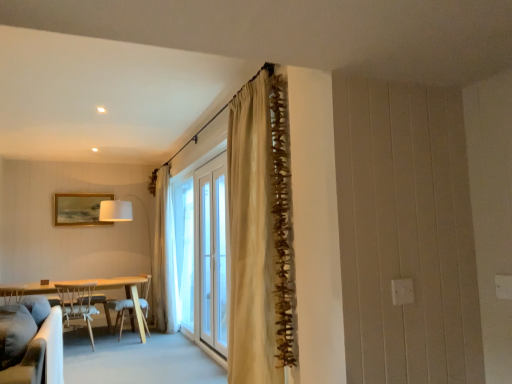
Question: Is white wood chair at left, which is the 2th chair in back-to-front order, bigger than white glass screen door at center?

Choices:
 (A) yes
 (B) no

Answer: (A)

Question: From the image's perspective, is white wood chair at left, which is the 2th chair in back-to-front order, on white glass screen door at center?

Choices:
 (A) yes
 (B) no

Answer: (B)

Question: Considering the relative positions of white wood chair at left, the first chair in the front-to-back sequence, and white glass screen door at center in the image provided, is white wood chair at left, the first chair in the front-to-back sequence, behind white glass screen door at center?

Choices:
 (A) no
 (B) yes

Answer: (B)

Question: Is white wood chair at left, which is the 2th chair in back-to-front order, to the left of white glass screen door at center from the viewer's perspective?

Choices:
 (A) yes
 (B) no

Answer: (A)

Question: Could you tell me if white wood chair at left, the first chair in the front-to-back sequence, is facing white glass screen door at center?

Choices:
 (A) no
 (B) yes

Answer: (A)

Question: Considering the relative sizes of white wood chair at left, the first chair in the front-to-back sequence, and white glass screen door at center in the image provided, is white wood chair at left, the first chair in the front-to-back sequence, thinner than white glass screen door at center?

Choices:
 (A) no
 (B) yes

Answer: (A)

Question: Considering the relative positions of wooden chair at lower left, which is the 1th chair in back-to-front order, and white wood chair at left, which is the 2th chair in back-to-front order, in the image provided, is wooden chair at lower left, which is the 1th chair in back-to-front order, in front of white wood chair at left, which is the 2th chair in back-to-front order,?

Choices:
 (A) yes
 (B) no

Answer: (B)

Question: Considering the relative sizes of wooden chair at lower left, which is counted as the second chair, starting from the front, and white wood chair at left, the first chair in the front-to-back sequence, in the image provided, is wooden chair at lower left, which is counted as the second chair, starting from the front, taller than white wood chair at left, the first chair in the front-to-back sequence,?

Choices:
 (A) yes
 (B) no

Answer: (B)

Question: Considering the relative sizes of wooden chair at lower left, which is counted as the second chair, starting from the front, and white wood chair at left, which is the 2th chair in back-to-front order, in the image provided, is wooden chair at lower left, which is counted as the second chair, starting from the front, bigger than white wood chair at left, which is the 2th chair in back-to-front order,?

Choices:
 (A) no
 (B) yes

Answer: (A)

Question: From the image's perspective, is wooden chair at lower left, which is counted as the second chair, starting from the front, below white wood chair at left, the first chair in the front-to-back sequence?

Choices:
 (A) no
 (B) yes

Answer: (B)

Question: Is wooden chair at lower left, which is the 1th chair in back-to-front order, looking in the opposite direction of white wood chair at left, the first chair in the front-to-back sequence?

Choices:
 (A) no
 (B) yes

Answer: (A)

Question: Is wooden chair at lower left, which is the 1th chair in back-to-front order, oriented towards white wood chair at left, which is the 2th chair in back-to-front order?

Choices:
 (A) yes
 (B) no

Answer: (B)

Question: From a real-world perspective, is light wood table at left physically above white fabric lampshade at left?

Choices:
 (A) yes
 (B) no

Answer: (B)